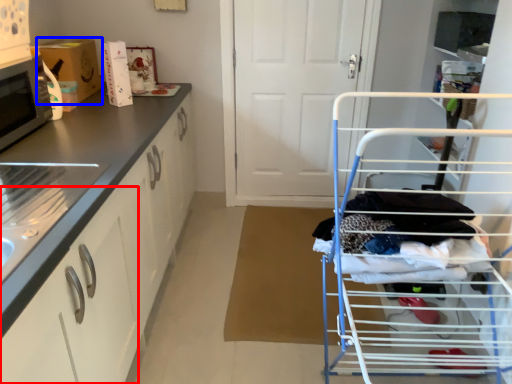
Question: Which object is closer to the camera taking this photo, drawer (highlighted by a red box) or cardboard box (highlighted by a blue box)?

Choices:
 (A) drawer
 (B) cardboard box

Answer: (A)